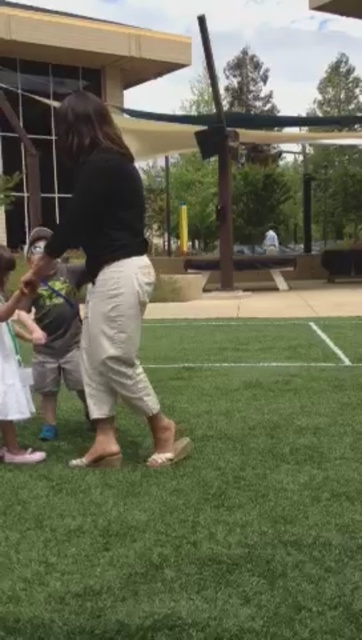
Question: From the image, what is the correct spatial relationship of green grass at center in relation to green fabric shorts at center?

Choices:
 (A) above
 (B) below

Answer: (B)

Question: Is green grass at center to the right of green fabric shorts at center from the viewer's perspective?

Choices:
 (A) no
 (B) yes

Answer: (B)

Question: Which point is closer to the camera?

Choices:
 (A) (7, 305)
 (B) (111, 218)

Answer: (B)

Question: Estimate the real-world distances between objects in this image. Which object is closer to the matte black shirt at center?

Choices:
 (A) green fabric shorts at center
 (B) green grass at center
 (C) white fabric bag at lower left

Answer: (C)

Question: Does matte black shirt at center have a smaller size compared to white fabric bag at lower left?

Choices:
 (A) no
 (B) yes

Answer: (A)

Question: Among these objects, which one is farthest from the camera?

Choices:
 (A) green grass at center
 (B) matte black shirt at center
 (C) white fabric bag at lower left

Answer: (A)